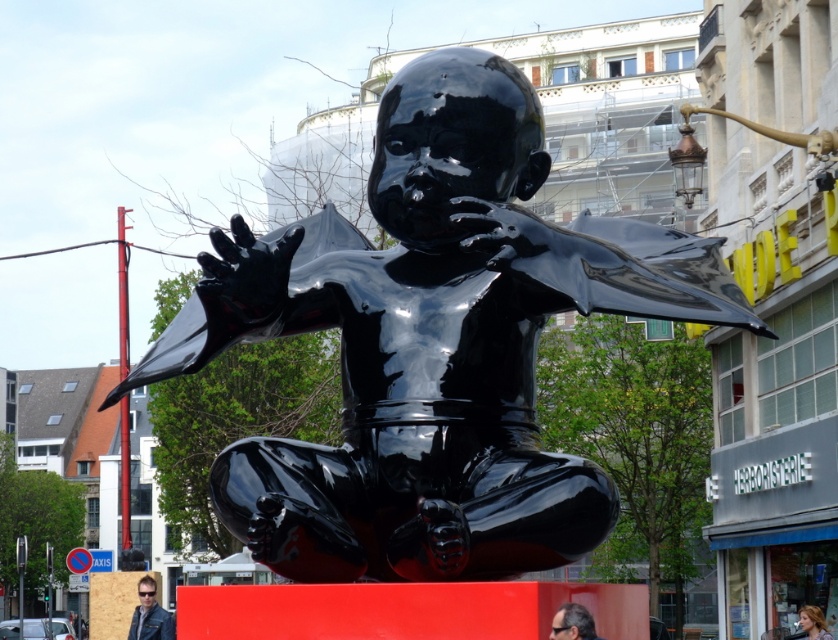
You are an art curator standing in front of the sculpture and want to move from the leather jacket at lower left to the blonde hair at lower right. Which direction should you turn to face the object that is closer to you?

The leather jacket at lower left is closer to you, so you should not turn and stay facing it.

You are an artist observing the sculpture and the surrounding area. You notice two people in the background with dark brown hair at lower center and blonde hair at lower right. Which person is standing closer to the sculpture?

The dark brown hair at lower center is positioned over blonde hair at lower right, so the person with dark brown hair at lower center is closer to the sculpture.